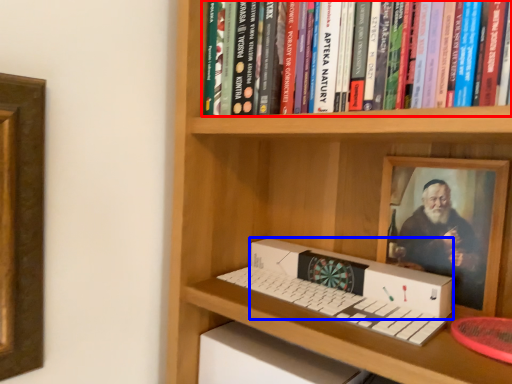
Question: Among these objects, which one is nearest to the camera, book (highlighted by a red box) or box (highlighted by a blue box)?

Choices:
 (A) book
 (B) box

Answer: (A)